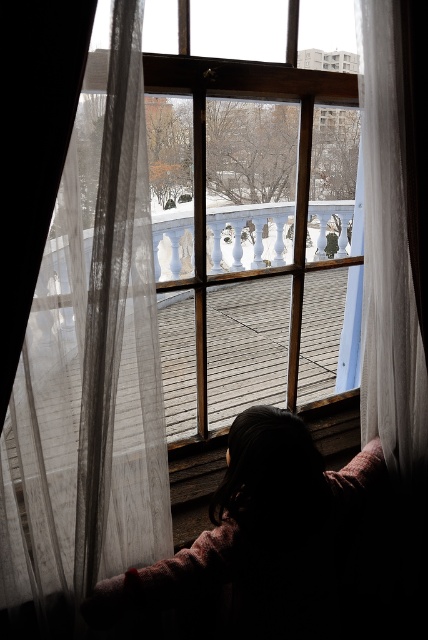
In the scene shown: You are standing in a room with a window that has sheer white curtains. You notice a point marked at coordinates (89, 371). Based on the scene, can you determine which object this point is located on?

The point at coordinates (89, 371) is located on the sheer white curtain at left.

You are standing in a room with a window framed by two curtains. You notice the sheer white curtain at left and the translucent fabric curtain at right. Which curtain is closer to the left side of the window?

The sheer white curtain at left is closer to the left side of the window because it is positioned on the left side of the translucent fabric curtain at right.

You are standing in a room with a window and want to reach the silky pink sweater at lower center. However, there is a sheer white curtain at left in your way. Can you walk around the curtain to get to the sweater without moving it?

The sheer white curtain at left is closer to the viewer than the silky pink sweater at lower center. Since the curtain is closer, you can walk around it to access the sweater without moving it.